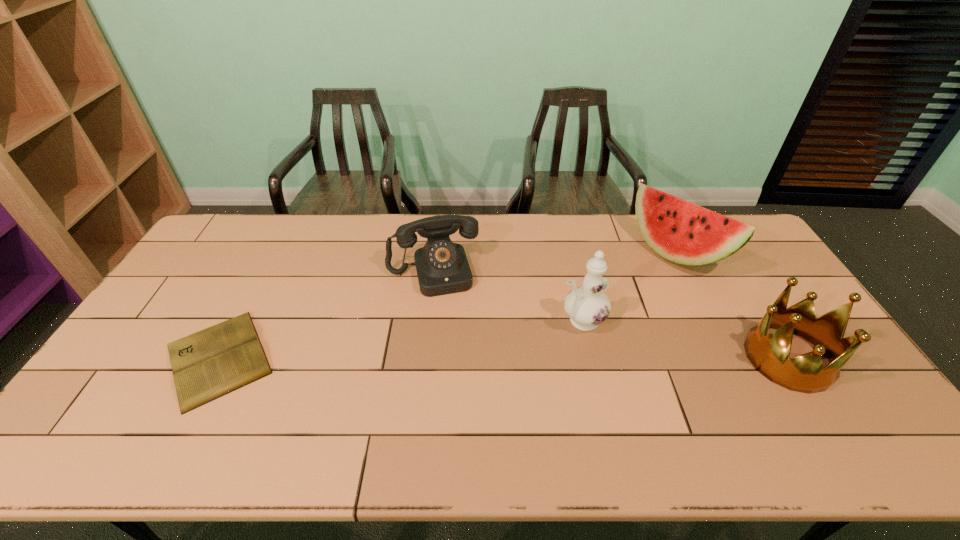
Image resolution: width=960 pixels, height=540 pixels. In order to click on free space on the desktop that is between the shortest object and the crown and is positioned on the dial of the fourth tallest object in this screenshot , I will do `click(451, 358)`.

The width and height of the screenshot is (960, 540). Identify the location of free spot on the desktop that is between the shortest object and the crown and is positioned at the spout of the third object from left to right. (505, 358).

Locate an element on the screen. The width and height of the screenshot is (960, 540). free spot on the desktop that is between the shortest object and the crown and is positioned on the outer rind of the watermelon is located at coordinates (559, 358).